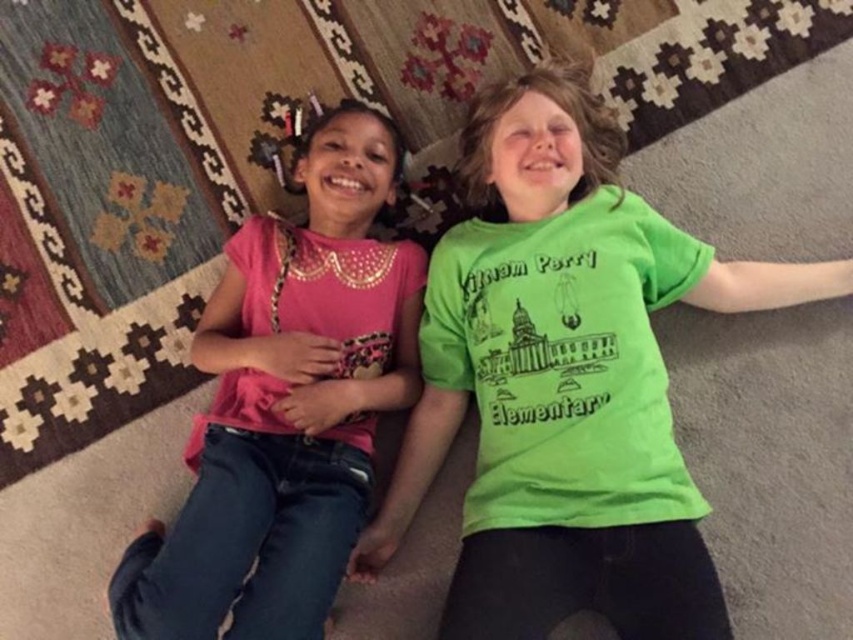
Is green matte shirt at center shorter than pink satin shirt at left?

No.

Which is behind, point (601, 170) or point (335, 168)?

Positioned behind is point (601, 170).

Image resolution: width=853 pixels, height=640 pixels. Find the location of `green matte shirt at center`. green matte shirt at center is located at coordinates (566, 380).